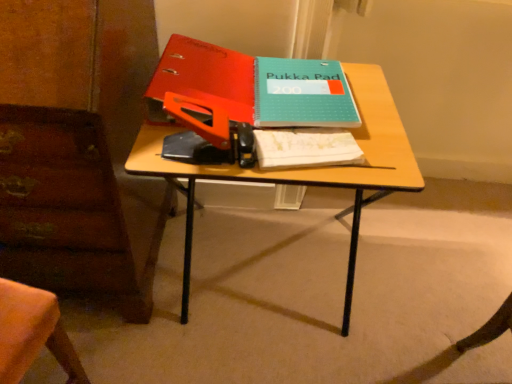
Question: From the image's perspective, is wooden desk at center positioned above or below white paper notebook at center?

Choices:
 (A) above
 (B) below

Answer: (B)

Question: Would you say wooden desk at center is inside or outside white paper notebook at center?

Choices:
 (A) outside
 (B) inside

Answer: (A)

Question: Considering the real-world distances, which object is farthest from the matte orange binder at upper center, the 2th paperback book viewed from the right?

Choices:
 (A) white paper notebook at center
 (B) teal matte notebook at center, which is the second paperback book from left to right
 (C) wooden desk at center

Answer: (A)

Question: Estimate the real-world distances between objects in this image. Which object is closer to the wooden desk at center?

Choices:
 (A) matte orange binder at upper center, the 2th paperback book viewed from the right
 (B) teal matte notebook at center, which ranks as the 1th paperback book in right-to-left order
 (C) white paper notebook at center

Answer: (C)